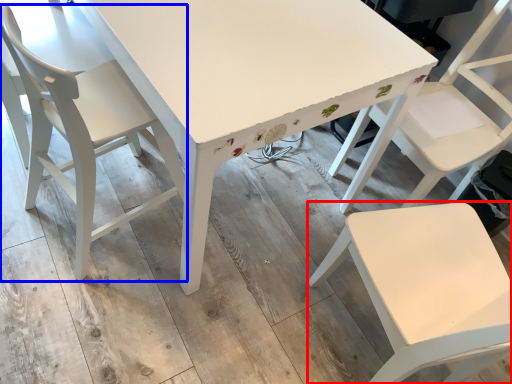
Question: Among these objects, which one is farthest to the camera, chair (highlighted by a red box) or chair (highlighted by a blue box)?

Choices:
 (A) chair
 (B) chair

Answer: (B)